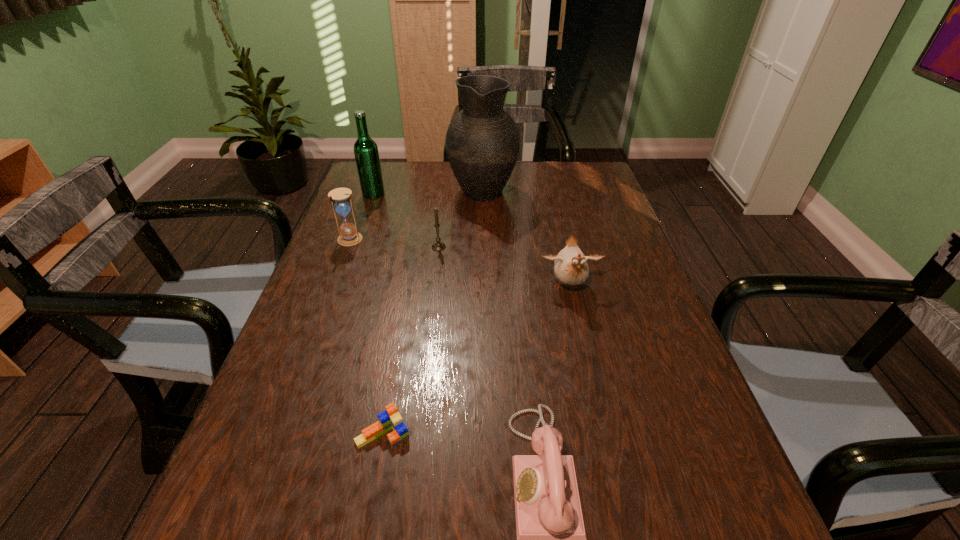
Where is `free spot located 0.130m on the back of the hourglass`? The height and width of the screenshot is (540, 960). free spot located 0.130m on the back of the hourglass is located at coordinates pos(362,207).

Locate an element on the screen. The width and height of the screenshot is (960, 540). vacant point located 0.340m at the beak of the third nearest object is located at coordinates (603, 441).

Where is `free space located 0.350m on the back of the candle`? This screenshot has height=540, width=960. free space located 0.350m on the back of the candle is located at coordinates (446, 180).

Locate an element on the screen. The image size is (960, 540). vacant position located on the right of the shortest object is located at coordinates (545, 433).

Find the location of a particular element. pitcher that is at the far edge is located at coordinates (482, 142).

Where is `beer bottle present at the far edge`? The width and height of the screenshot is (960, 540). beer bottle present at the far edge is located at coordinates (366, 153).

Find the location of a particular element. This screenshot has width=960, height=540. beer bottle present at the left edge is located at coordinates (366, 153).

This screenshot has width=960, height=540. Identify the location of hourglass that is at the left edge. (341, 201).

Locate an element on the screen. This screenshot has width=960, height=540. object at the right edge is located at coordinates (570, 265).

Where is `object located at the far left corner`? object located at the far left corner is located at coordinates (366, 153).